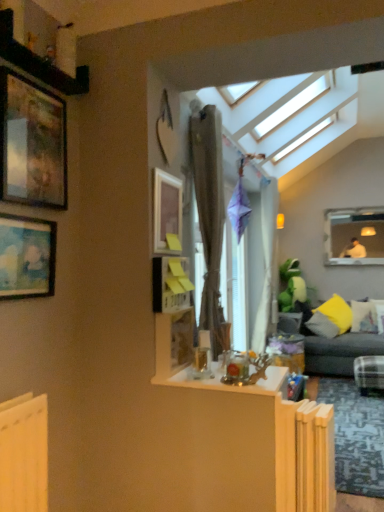
Question: Does dark gray fabric couch at right have a smaller size compared to matte white frame at upper right, acting as the 1th window frame starting from the back?

Choices:
 (A) yes
 (B) no

Answer: (B)

Question: Does dark gray fabric couch at right have a lesser height compared to matte white frame at upper right, which ranks as the 2th window frame in front-to-back order?

Choices:
 (A) no
 (B) yes

Answer: (B)

Question: Does dark gray fabric couch at right contain matte white frame at upper right, which ranks as the 2th window frame in front-to-back order?

Choices:
 (A) yes
 (B) no

Answer: (B)

Question: From the image's perspective, is dark gray fabric couch at right under matte white frame at upper right, acting as the 1th window frame starting from the back?

Choices:
 (A) no
 (B) yes

Answer: (B)

Question: Is dark gray fabric couch at right taller than matte white frame at upper right, which ranks as the first window frame in right-to-left order?

Choices:
 (A) no
 (B) yes

Answer: (A)

Question: Considering the positions of point (317, 316) and point (347, 305), is point (317, 316) closer or farther from the camera than point (347, 305)?

Choices:
 (A) closer
 (B) farther

Answer: (A)

Question: From a real-world perspective, is yellow fabric pillow at right, which appears as the 1th pillow when viewed from the left, physically located above or below yellow fabric pillow at right, marked as the second pillow in a left-to-right arrangement?

Choices:
 (A) below
 (B) above

Answer: (A)

Question: Would you say yellow fabric pillow at right, which appears as the 1th pillow when viewed from the left, is to the left or to the right of yellow fabric pillow at right, marked as the second pillow in a left-to-right arrangement, in the picture?

Choices:
 (A) left
 (B) right

Answer: (A)

Question: From the image's perspective, is yellow fabric pillow at right, which is counted as the 3th pillow, starting from the right, positioned above or below yellow fabric pillow at right, marked as the second pillow in a left-to-right arrangement?

Choices:
 (A) above
 (B) below

Answer: (B)

Question: Does point (165, 175) appear closer or farther from the camera than point (210, 389)?

Choices:
 (A) closer
 (B) farther

Answer: (B)

Question: In terms of width, does matte wooden picture frame at upper center, placed as the third picture frame when sorted from left to right, look wider or thinner when compared to clear glass table at center?

Choices:
 (A) thin
 (B) wide

Answer: (A)

Question: From a real-world perspective, relative to clear glass table at center, is matte wooden picture frame at upper center, marked as the 2th picture frame in a top-to-bottom arrangement, vertically above or below?

Choices:
 (A) above
 (B) below

Answer: (A)

Question: Would you say matte wooden picture frame at upper center, marked as the 2th picture frame in a top-to-bottom arrangement, is inside or outside clear glass table at center?

Choices:
 (A) outside
 (B) inside

Answer: (A)

Question: In terms of size, does wooden picture frame at center, which ranks as the first picture frame in bottom-to-top order, appear bigger or smaller than yellow fabric pillow at right, the 3th pillow viewed from the left?

Choices:
 (A) small
 (B) big

Answer: (A)

Question: Considering the positions of point (185, 348) and point (350, 308), is point (185, 348) closer or farther from the camera than point (350, 308)?

Choices:
 (A) farther
 (B) closer

Answer: (B)